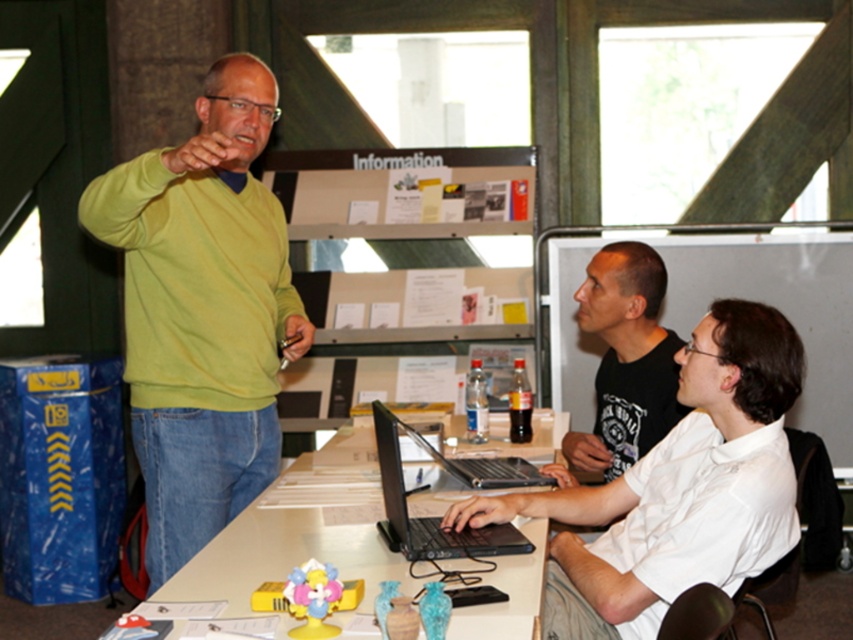
You are a photographer positioned behind the lime green sweater and blue jeans man. You want to take a photo of the black matte shirt at center and the black plastic laptop at center without any obstruction. Which object should you place closer to the camera to ensure both are fully visible in the frame?

The black matte shirt at center is larger in size than the black plastic laptop at center. To ensure both are fully visible, you should place the black matte shirt at center closer to the camera since its larger size requires more space in the frame.

You are standing at the center of the table and want to reach both the point at (x=662, y=348) and the point at (x=506, y=464). Which point should you go to first to minimize the total distance traveled?

You should go to point (x=506, y=464) first because it is closer to you than point (x=662, y=348), so going there first minimizes the total distance traveled.

You are sitting at the black matte laptop at center and want to hand a document to the person wearing the green matte sweater at upper left. Can you reach them without leaving your seat?

The green matte sweater at upper left is to the left of the black matte laptop at center, so you can reach them by extending your arm to the left side of the table.